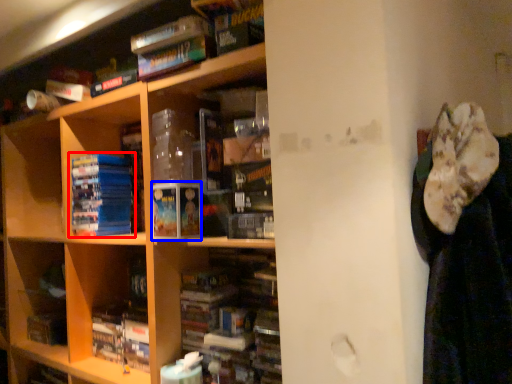
Question: Among these objects, which one is nearest to the camera, book (highlighted by a red box) or paperback book (highlighted by a blue box)?

Choices:
 (A) book
 (B) paperback book

Answer: (B)